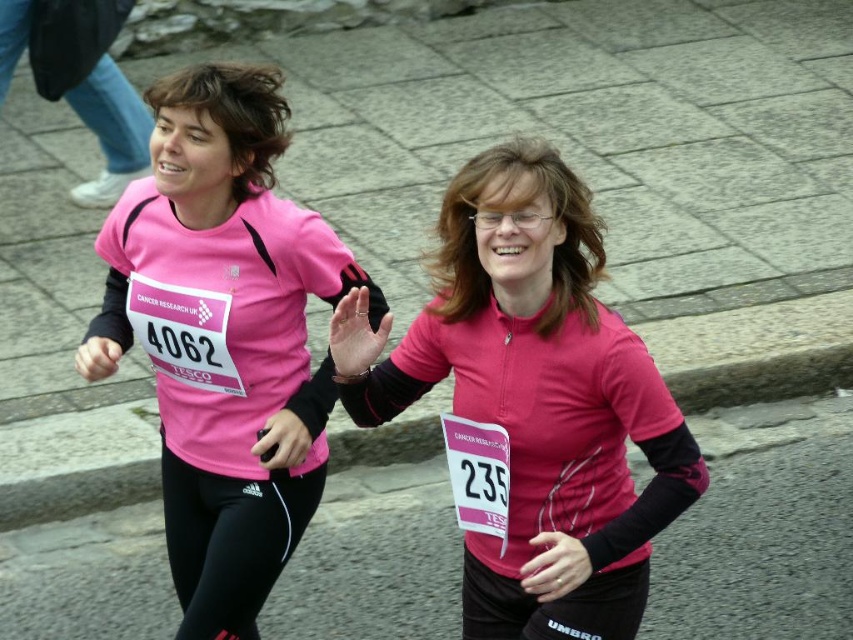
Question: Can you confirm if pink zip-up jacket at center is positioned below matte pink shirt at center?

Choices:
 (A) yes
 (B) no

Answer: (A)

Question: Which point is farther from the camera taking this photo?

Choices:
 (A) (583, 387)
 (B) (268, 288)

Answer: (B)

Question: Can you confirm if pink zip-up jacket at center is positioned to the left of matte pink shirt at center?

Choices:
 (A) no
 (B) yes

Answer: (A)

Question: Among these points, which one is nearest to the camera?

Choices:
 (A) (292, 243)
 (B) (660, 477)

Answer: (B)

Question: Is pink zip-up jacket at center positioned before matte pink shirt at center?

Choices:
 (A) yes
 (B) no

Answer: (A)